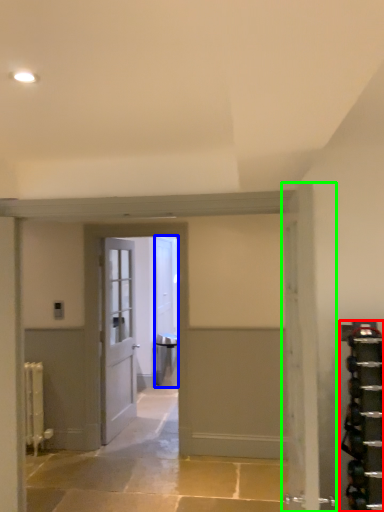
Question: Based on their relative distances, which object is farther from shelf (highlighted by a red box)? Choose from door (highlighted by a blue box) and door (highlighted by a green box).

Choices:
 (A) door
 (B) door

Answer: (A)